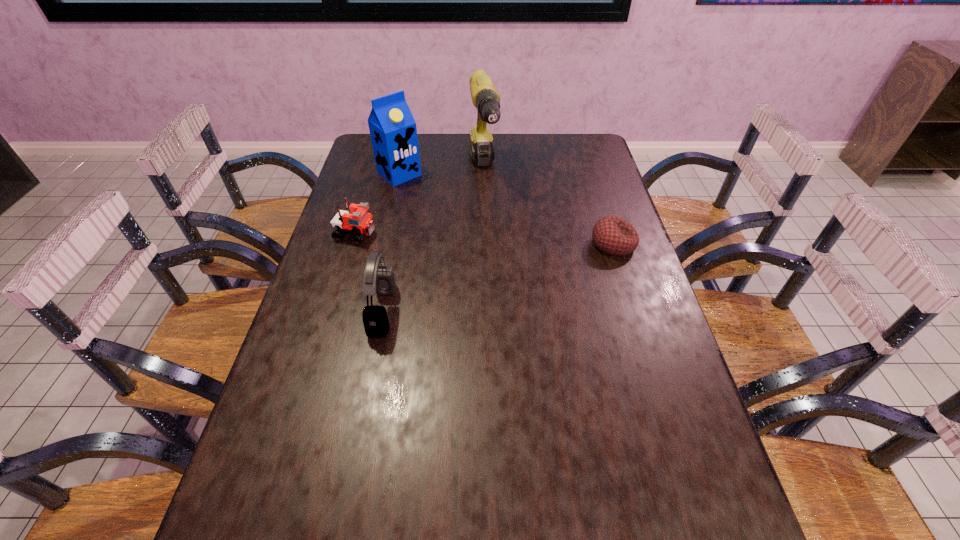
The height and width of the screenshot is (540, 960). I want to click on blank area located on the front-facing side of the Lego, so click(501, 259).

Image resolution: width=960 pixels, height=540 pixels. I want to click on vacant region located 0.150m on the front-facing side of the Lego, so click(x=421, y=245).

You are a GUI agent. You are given a task and a screenshot of the screen. Output one action in this format:
    pyautogui.click(x=<x>, y=<y>)
    Task: Click on the vacant space located 0.300m on the handle side of the fourth object from left to right
    
    Given the screenshot: What is the action you would take?
    pyautogui.click(x=501, y=260)

The width and height of the screenshot is (960, 540). I want to click on vacant point located on the handle side of the fourth object from left to right, so click(x=503, y=267).

I want to click on free space located on the handle side of the fourth object from left to right, so click(490, 214).

Where is `vacant space located 0.300m with the cap open on the carton`? vacant space located 0.300m with the cap open on the carton is located at coordinates (464, 228).

Locate an element on the screen. The height and width of the screenshot is (540, 960). free space located with the cap open on the carton is located at coordinates (476, 238).

I want to click on free space located with the cap open on the carton, so click(x=476, y=238).

This screenshot has height=540, width=960. Identify the location of drill that is at the far edge. (485, 97).

The width and height of the screenshot is (960, 540). What are the coordinates of `carton present at the far edge` in the screenshot? It's located at (393, 131).